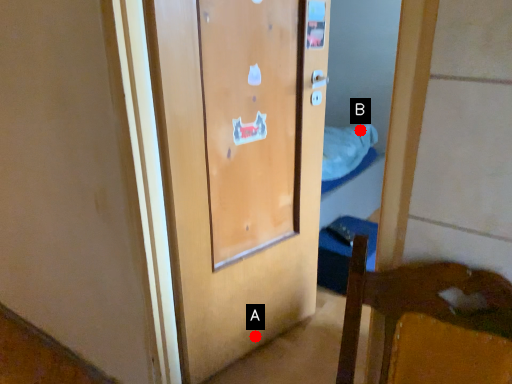
Question: Two points are circled on the image, labeled by A and B beside each circle. Which point is farther to the camera?

Choices:
 (A) A is further
 (B) B is further

Answer: (B)